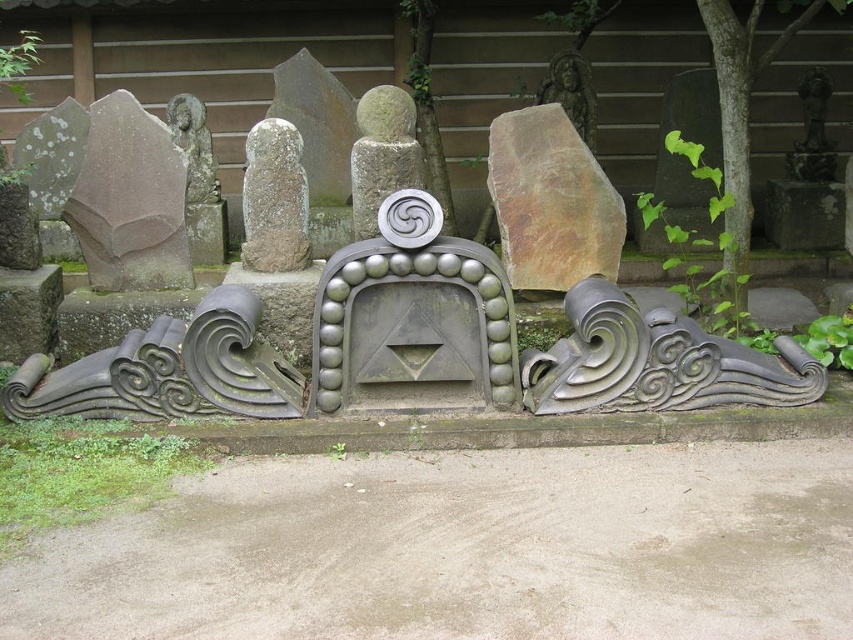
Can you confirm if polished stone carving at center is smaller than bronze statue at upper right?

Actually, polished stone carving at center might be larger than bronze statue at upper right.

The width and height of the screenshot is (853, 640). Find the location of `polished stone carving at center`. polished stone carving at center is located at coordinates (415, 348).

Between point (259, 385) and point (825, 115), which one is positioned in front?

Point (259, 385)

The image size is (853, 640). I want to click on polished stone carving at center, so click(415, 348).

Does point (387, 104) lie behind point (173, 120)?

No, it is in front of (173, 120).

Is point (379, 131) closer to camera compared to point (192, 173)?

Yes, point (379, 131) is in front of point (192, 173).

Locate an element on the screen. smooth gray stone at center is located at coordinates (381, 154).

Measure the distance between polished stone carving at center and smooth gray stone at center.

A distance of 1.40 meters exists between polished stone carving at center and smooth gray stone at center.

Does polished stone carving at center have a lesser width compared to smooth gray stone at center?

Incorrect, polished stone carving at center's width is not less than smooth gray stone at center's.

Who is more distant from viewer, (552, 376) or (407, 163)?

The point (407, 163) is behind.

Where is `polished stone carving at center`? polished stone carving at center is located at coordinates (415, 348).